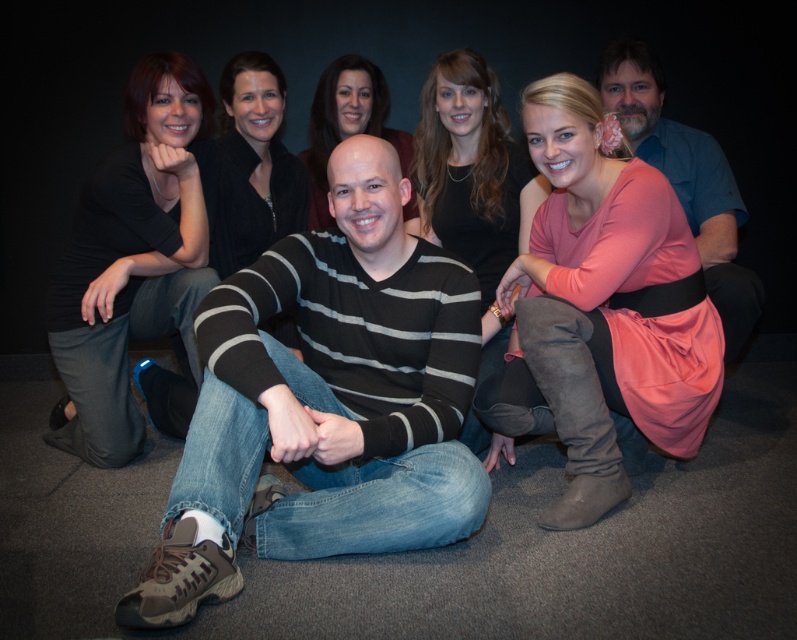
Question: Which object is positioned closest to the matte black shirt at left?

Choices:
 (A) striped sweater at center
 (B) pink satin dress at center

Answer: (A)

Question: Which of the following is the farthest from the observer?

Choices:
 (A) pink satin dress at center
 (B) striped sweater at center
 (C) matte black hair at upper center
 (D) matte black shirt at left

Answer: (C)

Question: Which object is positioned farthest from the matte black shirt at left?

Choices:
 (A) pink satin dress at center
 (B) striped sweater at center
 (C) blue denim shirt at upper right

Answer: (C)

Question: Does pink satin dress at center appear on the right side of matte black shirt at left?

Choices:
 (A) no
 (B) yes

Answer: (B)

Question: Is striped sweater at center closer to camera compared to matte black shirt at left?

Choices:
 (A) no
 (B) yes

Answer: (B)

Question: Does pink satin dress at center have a greater width compared to matte black hair at upper center?

Choices:
 (A) no
 (B) yes

Answer: (B)